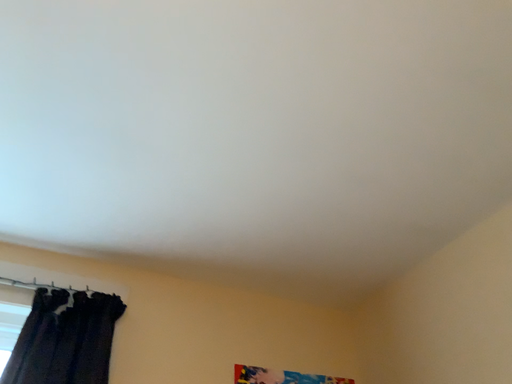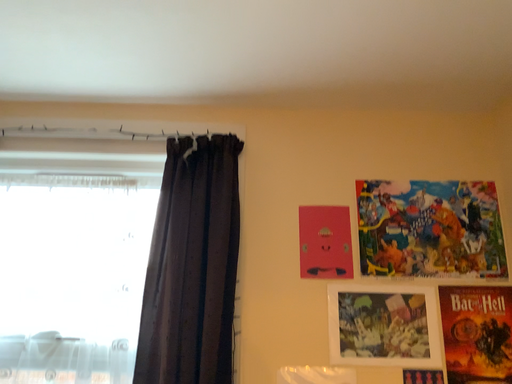
Question: Which way did the camera rotate in the video?

Choices:
 (A) rotated left
 (B) rotated right

Answer: (A)